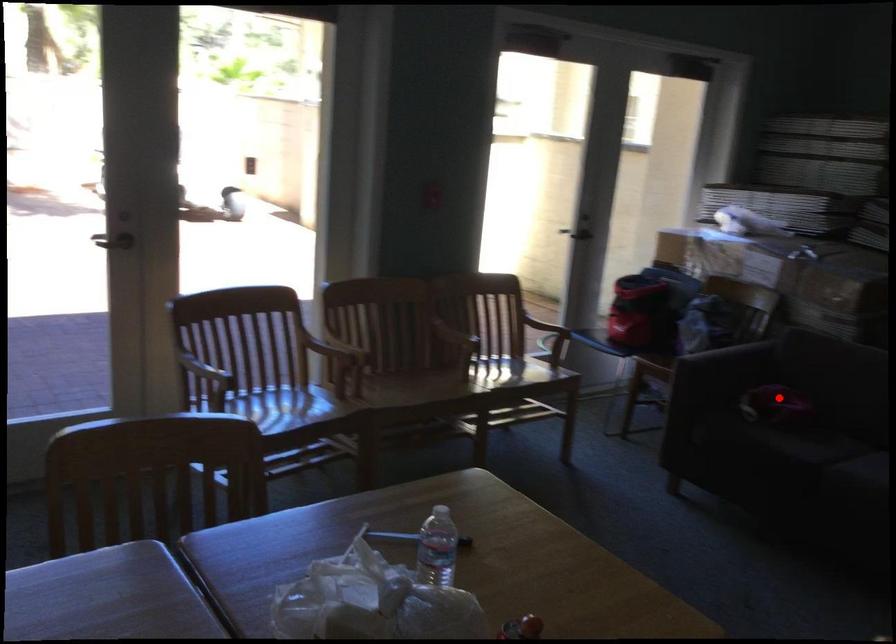
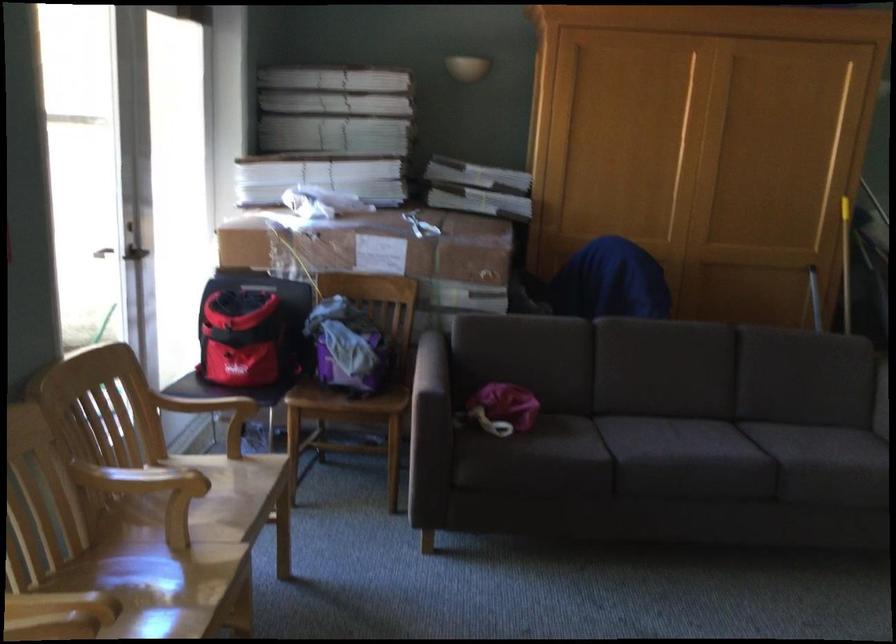
The point at the highlighted location is marked in the first image. Where is the corresponding point in the second image?

(503, 408)